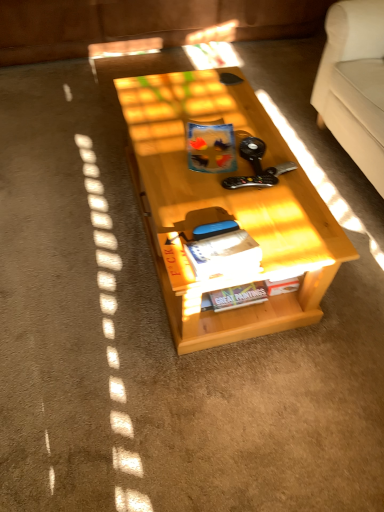
Question: In terms of height, does matte plastic book at center, which ranks as the 1th book in top-to-bottom order, look taller or shorter compared to hardcover book at center, which appears as the 2th book when viewed from the top?

Choices:
 (A) short
 (B) tall

Answer: (B)

Question: Looking at their shapes, would you say matte plastic book at center, which ranks as the 1th book in top-to-bottom order, is wider or thinner than hardcover book at center, marked as the 3th book in a back-to-front arrangement?

Choices:
 (A) thin
 (B) wide

Answer: (B)

Question: Estimate the real-world distances between objects in this image. Which object is closer to the light wood table at center?

Choices:
 (A) matte plastic book at center, placed as the 3th book when sorted from bottom to top
 (B) matte paper magazine at center
 (C) hardcover book at center, which is the first book in bottom-to-top order
 (D) hardcover book at center, which is the second book from bottom to top

Answer: (D)

Question: Based on their relative distances, which object is nearer to the matte plastic book at center, which ranks as the 1th book in top-to-bottom order?

Choices:
 (A) matte paper magazine at center
 (B) hardcover book at center, positioned as the 1th book in back-to-front order
 (C) hardcover book at center, which appears as the 2th book when viewed from the top
 (D) light wood table at center

Answer: (D)